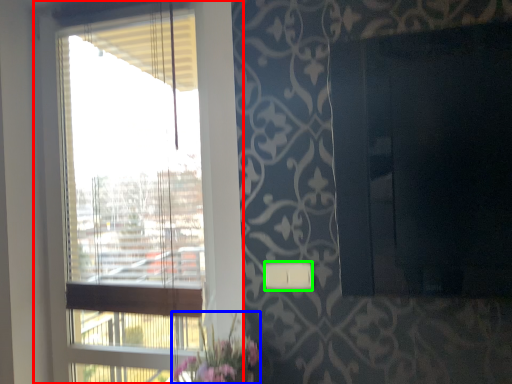
Question: Estimate the real-world distances between objects in this image. Which object is farther from window (highlighted by a red box), floral arrangement (highlighted by a blue box) or light switch (highlighted by a green box)?

Choices:
 (A) floral arrangement
 (B) light switch

Answer: (B)